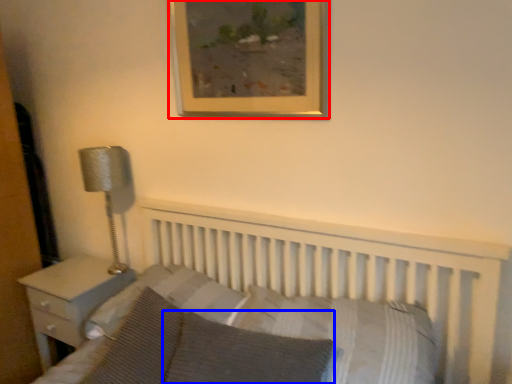
Question: Which object appears farthest to the camera in this image, picture frame (highlighted by a red box) or pillow (highlighted by a blue box)?

Choices:
 (A) picture frame
 (B) pillow

Answer: (A)